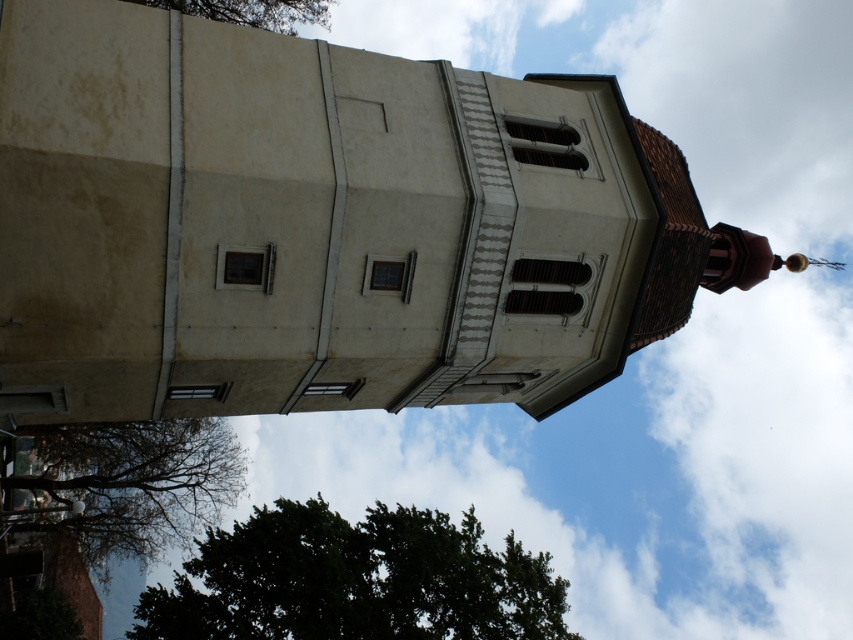
Question: Among these points, which one is farthest from the camera?

Choices:
 (A) (524, 624)
 (B) (120, 422)
 (C) (134, 1)

Answer: (B)

Question: Is green leafy tree at lower left closer to the viewer compared to green leafy tree at upper center?

Choices:
 (A) yes
 (B) no

Answer: (A)

Question: Which of the following is the farthest from the observer?

Choices:
 (A) green leafy tree at lower left
 (B) green leafy tree at upper center
 (C) dark green leafy tree at lower left

Answer: (B)

Question: Which object appears farthest from the camera in this image?

Choices:
 (A) dark green leafy tree at lower left
 (B) green leafy tree at upper center
 (C) green leafy tree at lower left

Answer: (B)

Question: Observing the image, what is the correct spatial positioning of green leafy tree at lower left in reference to green leafy tree at upper center?

Choices:
 (A) above
 (B) below

Answer: (B)

Question: Considering the relative positions of green leafy tree at lower left and green leafy tree at upper center in the image provided, where is green leafy tree at lower left located with respect to green leafy tree at upper center?

Choices:
 (A) right
 (B) left

Answer: (B)